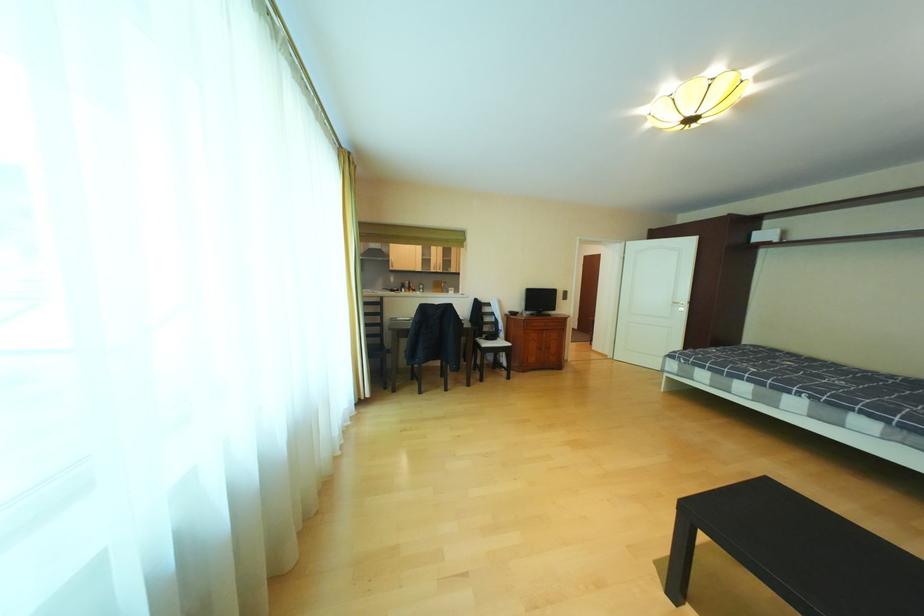
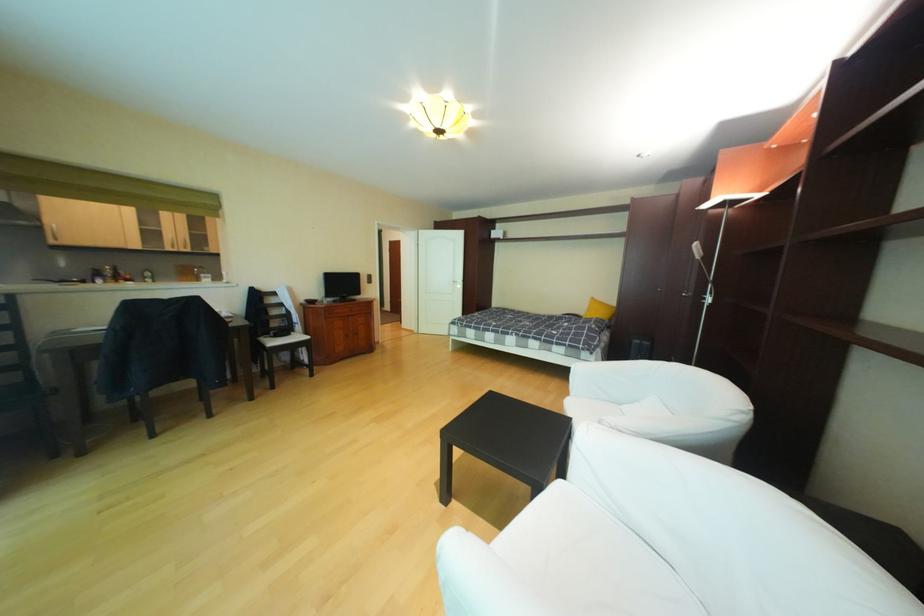
Question: The camera is either moving clockwise (left) or counter-clockwise (right) around the object. The first image is from the beginning of the video and the second image is from the end. Is the camera moving left or right when shooting the video?

Choices:
 (A) Left
 (B) Right

Answer: (A)